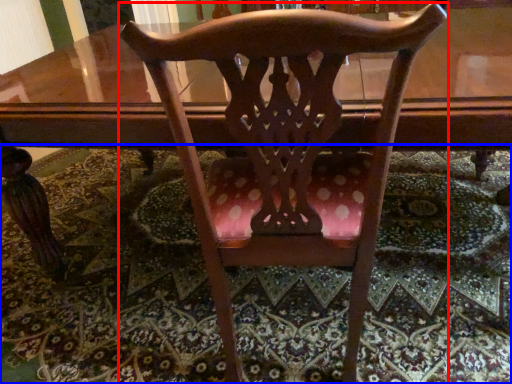
Question: Which object is further to the camera taking this photo, chair (highlighted by a red box) or mat (highlighted by a blue box)?

Choices:
 (A) chair
 (B) mat

Answer: (B)